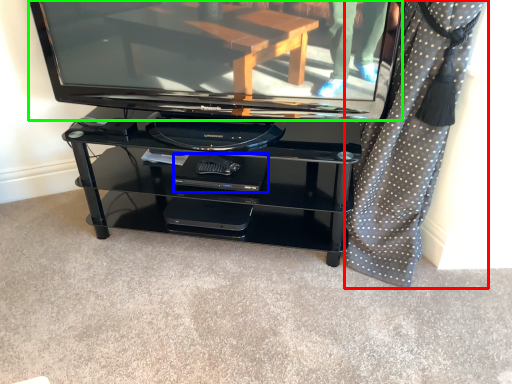
Question: Which object is positioned closest to curtain (highlighted by a red box)? Select from footrest (highlighted by a blue box) and television (highlighted by a green box).

Choices:
 (A) footrest
 (B) television

Answer: (B)